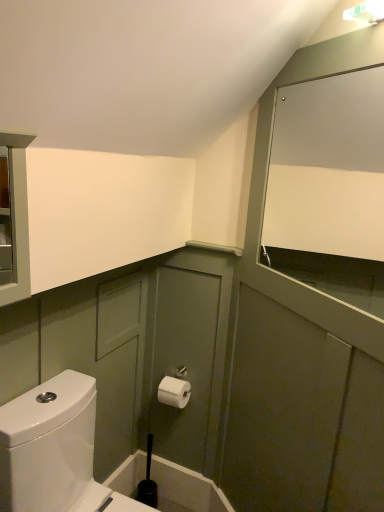
Question: From a real-world perspective, is black plastic toilet brush at lower center positioned above or below white matte cabinet at upper right?

Choices:
 (A) below
 (B) above

Answer: (A)

Question: In terms of height, does black plastic toilet brush at lower center look taller or shorter compared to white matte cabinet at upper right?

Choices:
 (A) short
 (B) tall

Answer: (A)

Question: Based on their relative distances, which object is nearer to the white glossy toilet at lower left?

Choices:
 (A) white paper toilet paper at center
 (B) white matte cabinet at upper right
 (C) black plastic toilet brush at lower center

Answer: (A)

Question: Which object is the farthest from the white glossy toilet at lower left?

Choices:
 (A) white matte cabinet at upper right
 (B) black plastic toilet brush at lower center
 (C) white paper toilet paper at center

Answer: (A)